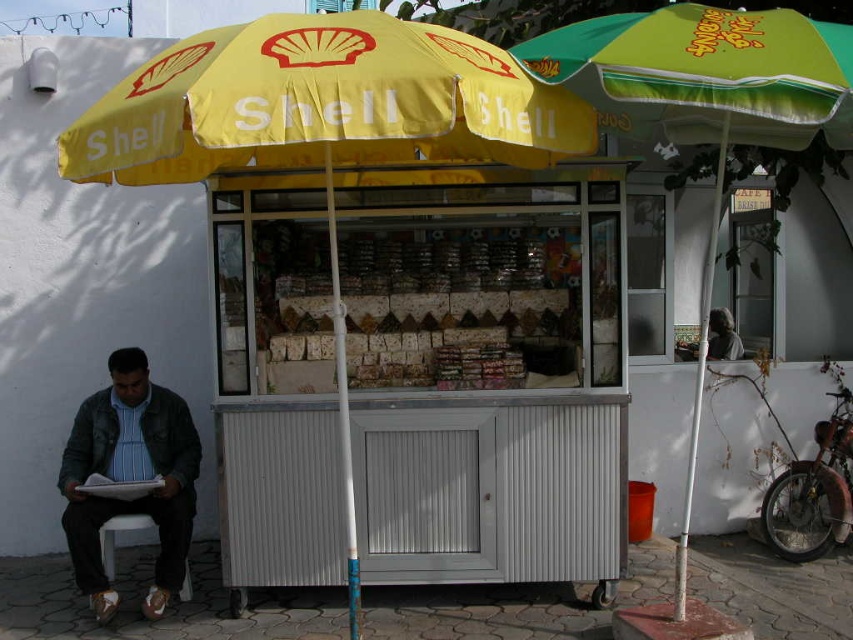
Can you confirm if yellow fabric umbrella at center is bigger than white plastic stool at lower left?

Correct, yellow fabric umbrella at center is larger in size than white plastic stool at lower left.

Can you confirm if yellow fabric umbrella at center is taller than white plastic stool at lower left?

Yes, yellow fabric umbrella at center is taller than white plastic stool at lower left.

Between point (398, 150) and point (135, 522), which one is positioned in front?

Point (398, 150) is in front.

Identify the location of yellow fabric umbrella at center. This screenshot has height=640, width=853. (322, 124).

What do you see at coordinates (322, 124) in the screenshot? I see `yellow fabric umbrella at center` at bounding box center [322, 124].

Can you confirm if yellow fabric umbrella at center is positioned to the right of denim jacket at lower left?

Indeed, yellow fabric umbrella at center is positioned on the right side of denim jacket at lower left.

The width and height of the screenshot is (853, 640). Describe the element at coordinates (322, 124) in the screenshot. I see `yellow fabric umbrella at center` at that location.

This screenshot has width=853, height=640. What are the coordinates of `yellow fabric umbrella at center` in the screenshot? It's located at (322, 124).

Does green fabric umbrella at upper right appear over white plastic stool at lower left?

Indeed, green fabric umbrella at upper right is positioned over white plastic stool at lower left.

Who is more forward, (779, 81) or (190, 586)?

Point (779, 81)

What do you see at coordinates (706, 106) in the screenshot?
I see `green fabric umbrella at upper right` at bounding box center [706, 106].

Find the location of a particular element. green fabric umbrella at upper right is located at coordinates (706, 106).